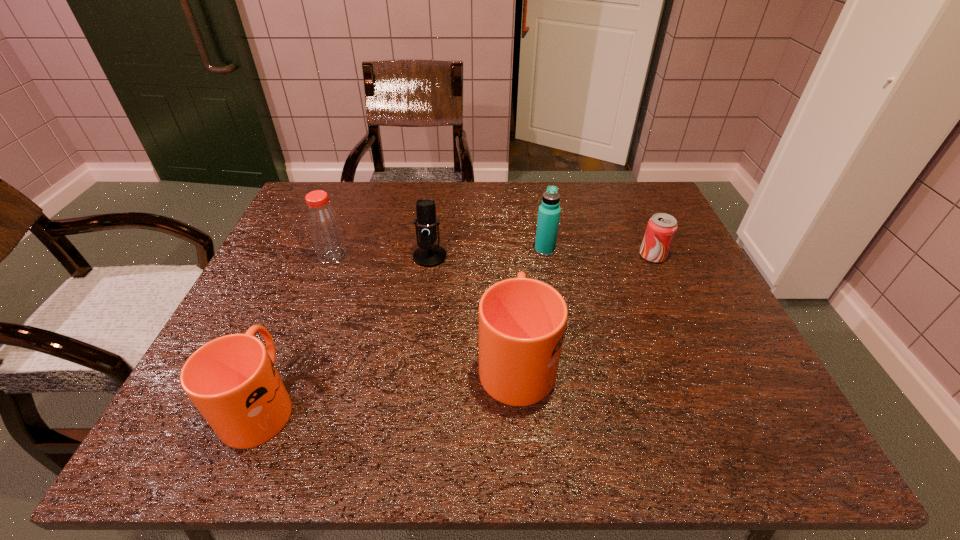
Image resolution: width=960 pixels, height=540 pixels. I want to click on vacant space that satisfies the following two spatial constraints: 1. on the handle side of the bottle; 2. on the right side of the left mug, so click(x=323, y=256).

What are the coordinates of `free space that satisfies the following two spatial constraints: 1. on the back side of the soda can; 2. on the right side of the third object from left to right` in the screenshot? It's located at (430, 256).

Locate an element on the screen. vacant region that satisfies the following two spatial constraints: 1. on the front side of the water bottle; 2. on the left side of the soda can is located at coordinates (546, 256).

The width and height of the screenshot is (960, 540). Identify the location of vacant region that satisfies the following two spatial constraints: 1. on the handle side of the shortest object; 2. on the right side of the shorter mug. (323, 256).

At what (x,y) coordinates should I click in order to perform the action: click on free space that satisfies the following two spatial constraints: 1. on the handle side of the left mug; 2. on the right side of the microphone. Please return your answer as a coordinate pair (x, y). Looking at the image, I should click on (323, 256).

This screenshot has height=540, width=960. I want to click on free region that satisfies the following two spatial constraints: 1. on the handle side of the left mug; 2. on the right side of the microphone, so click(x=323, y=256).

Identify the location of free point that satisfies the following two spatial constraints: 1. on the back side of the soda can; 2. on the right side of the bottle. The image size is (960, 540). (333, 256).